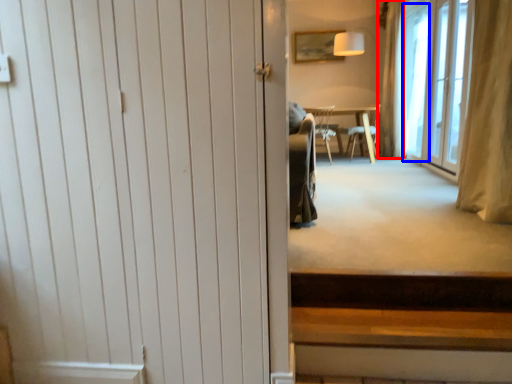
Question: Which object appears closest to the camera in this image, curtain (highlighted by a red box) or window screen (highlighted by a blue box)?

Choices:
 (A) curtain
 (B) window screen

Answer: (B)